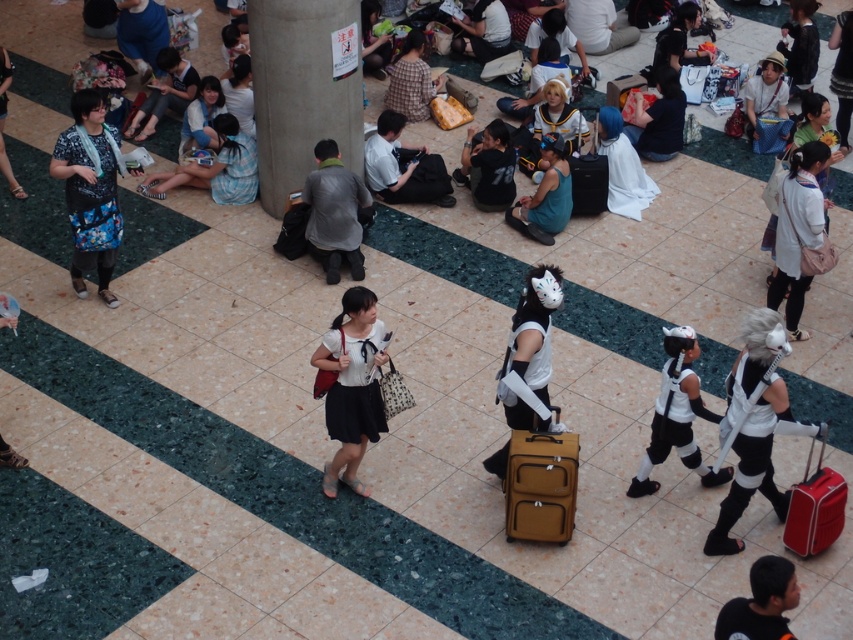
Question: Which point is farther from the camera taking this photo?

Choices:
 (A) (242, 65)
 (B) (749, 465)
 (C) (770, 74)
 (D) (364, 298)

Answer: (C)

Question: Is matte white shirt at center to the left of white plush toy at center from the viewer's perspective?

Choices:
 (A) no
 (B) yes

Answer: (B)

Question: Can you confirm if matte white shirt at center is wider than white plush toy at center?

Choices:
 (A) yes
 (B) no

Answer: (B)

Question: Is matte black shirt at upper left positioned at the back of white matte wig at upper center?

Choices:
 (A) yes
 (B) no

Answer: (A)

Question: Which of these objects is positioned closest to the white matte cosplay outfit at center?

Choices:
 (A) light blue fabric dress at upper left
 (B) matte black bag at left

Answer: (A)

Question: Which object is closer to the camera taking this photo?

Choices:
 (A) matte white shirt at center
 (B) white matte wig at upper center
 (C) white fabric bag at center
 (D) gray fabric shirt at center

Answer: (D)